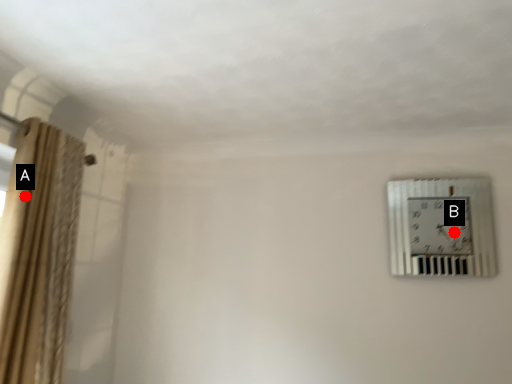
Question: Two points are circled on the image, labeled by A and B beside each circle. Which point is further to the camera?

Choices:
 (A) A is further
 (B) B is further

Answer: (B)